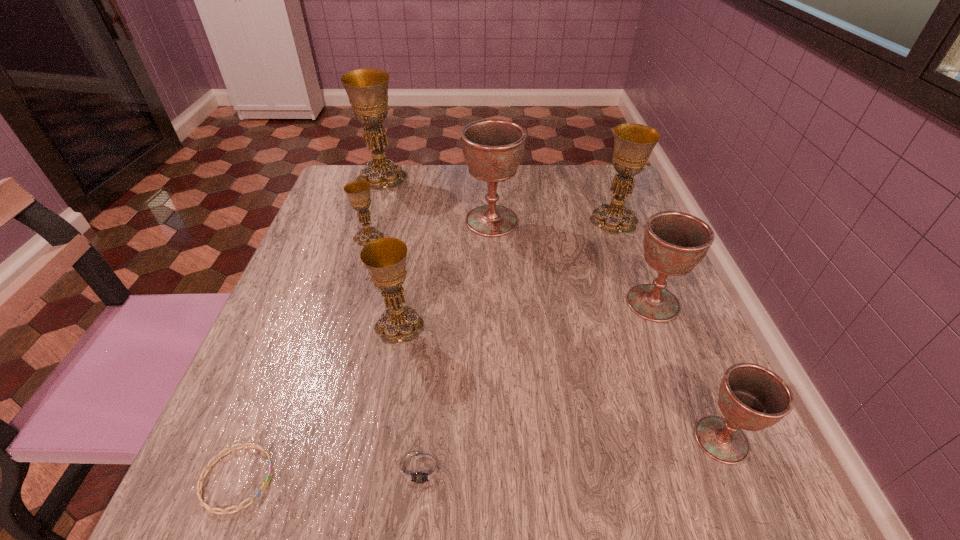
Find the location of a particular element. The width and height of the screenshot is (960, 540). the tallest chalice is located at coordinates (367, 89).

You are a GUI agent. You are given a task and a screenshot of the screen. Output one action in this format:
    pyautogui.click(x=<x>, y=<y>)
    Task: Click on the tallest object
    
    Given the screenshot: What is the action you would take?
    pyautogui.click(x=367, y=89)

Identify the location of the rightmost gold chalice. (633, 143).

Identify the location of the leftmost brown chalice. The width and height of the screenshot is (960, 540). (493, 148).

Identify the location of the biggest brown chalice. (493, 148).

Identify the location of the nearest gold chalice. (385, 258).

Identify the location of the third biggest gold chalice. pos(385,258).

This screenshot has height=540, width=960. I want to click on the second biggest brown chalice, so click(x=674, y=242).

The height and width of the screenshot is (540, 960). Find the location of `the smallest gold chalice`. the smallest gold chalice is located at coordinates (358, 191).

The image size is (960, 540). Identify the location of the nearest chalice. (751, 397).